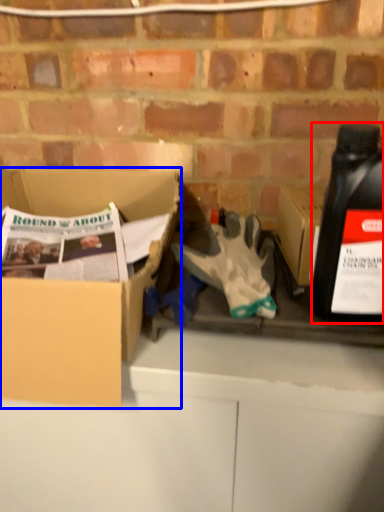
Question: Which point is closer to the camera, bottle (highlighted by a red box) or box (highlighted by a blue box)?

Choices:
 (A) bottle
 (B) box

Answer: (A)